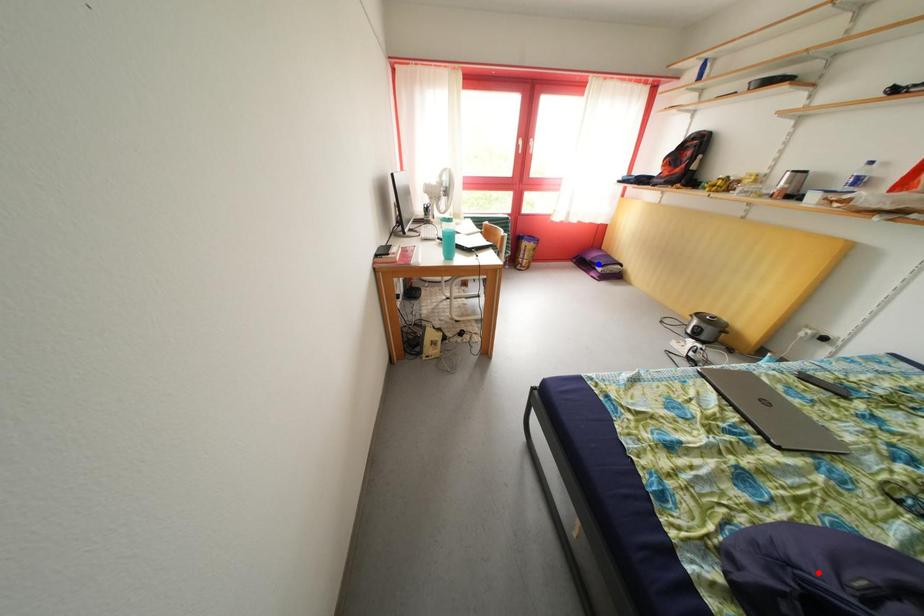
Question: Two points are marked on the image. Which point is closer to the camera?

Choices:
 (A) Blue point is closer.
 (B) Red point is closer.

Answer: (B)